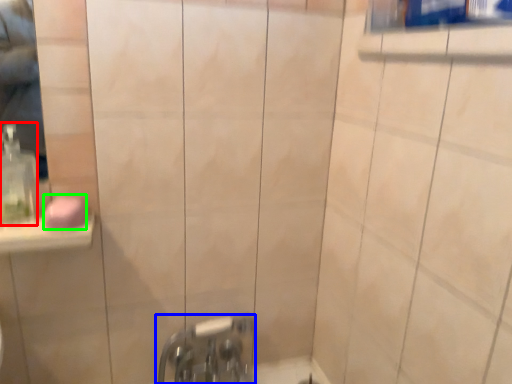
Question: Which object is positioned closest to soap dispenser (highlighted by a red box)? Select from tap (highlighted by a blue box) and soap (highlighted by a green box).

Choices:
 (A) tap
 (B) soap

Answer: (B)